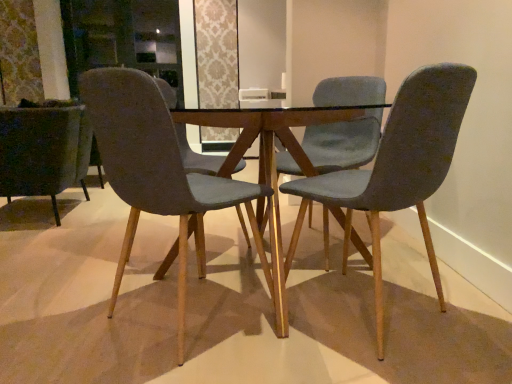
The image size is (512, 384). Describe the element at coordinates (157, 171) in the screenshot. I see `velvet grey chair at center, the 2th chair from the left` at that location.

In order to click on velvet grey chair at center, the 2th chair from the left in this screenshot , I will do `click(157, 171)`.

Between velvet grey chair at center, the 2th chair from the left, and velvet grey chair at right, the 4th chair from the left, which one has larger width?

velvet grey chair at center, the 2th chair from the left, is wider.

Between velvet teal chair at center, acting as the 2th chair starting from the right, and velvet dark green armchair at left, which is the 4th chair in right-to-left order, which one has more height?

With more height is velvet teal chair at center, acting as the 2th chair starting from the right.

Where is `the 2nd chair counting from the right side of the velvet dark green armchair at left, which is the 4th chair in right-to-left order`? The width and height of the screenshot is (512, 384). the 2nd chair counting from the right side of the velvet dark green armchair at left, which is the 4th chair in right-to-left order is located at coordinates (343, 142).

Is velvet teal chair at center, the 3th chair when ordered from left to right, bigger than velvet dark green armchair at left, which is the 4th chair in right-to-left order?

Incorrect, velvet teal chair at center, the 3th chair when ordered from left to right, is not larger than velvet dark green armchair at left, which is the 4th chair in right-to-left order.

Considering the positions of objects velvet teal chair at center, acting as the 2th chair starting from the right, and velvet dark green armchair at left, which is the 4th chair in right-to-left order, in the image provided, who is more to the left, velvet teal chair at center, acting as the 2th chair starting from the right, or velvet dark green armchair at left, which is the 4th chair in right-to-left order,?

From the viewer's perspective, velvet dark green armchair at left, which is the 4th chair in right-to-left order, appears more on the left side.

In terms of height, does velvet grey chair at right, the 4th chair from the left, look taller or shorter compared to velvet grey chair at center, which is the third chair in right-to-left order?

velvet grey chair at right, the 4th chair from the left, is taller than velvet grey chair at center, which is the third chair in right-to-left order.

In terms of width, does velvet grey chair at right, which appears as the first chair when viewed from the right, look wider or thinner when compared to velvet grey chair at center, the 2th chair from the left?

Considering their sizes, velvet grey chair at right, which appears as the first chair when viewed from the right, looks slimmer than velvet grey chair at center, the 2th chair from the left.

Is velvet grey chair at right, the 4th chair from the left, situated inside velvet grey chair at center, which is the third chair in right-to-left order, or outside?

velvet grey chair at right, the 4th chair from the left, is not enclosed by velvet grey chair at center, which is the third chair in right-to-left order.

What's the angular difference between velvet grey chair at right, which appears as the first chair when viewed from the right, and velvet grey chair at center, which is the third chair in right-to-left order,'s facing directions?

87.8 degrees separate the facing orientations of velvet grey chair at right, which appears as the first chair when viewed from the right, and velvet grey chair at center, which is the third chair in right-to-left order.

Between velvet dark green armchair at left, marked as the first chair in a left-to-right arrangement, and velvet teal chair at center, the 3th chair when ordered from left to right, which one has larger size?

With larger size is velvet dark green armchair at left, marked as the first chair in a left-to-right arrangement.

How distant is velvet dark green armchair at left, marked as the first chair in a left-to-right arrangement, from velvet teal chair at center, acting as the 2th chair starting from the right?

velvet dark green armchair at left, marked as the first chair in a left-to-right arrangement, is 1.51 meters from velvet teal chair at center, acting as the 2th chair starting from the right.

Does point (54, 141) appear closer or farther from the camera than point (345, 128)?

Point (54, 141) is positioned farther from the camera compared to point (345, 128).

Considering the relative positions of velvet dark green armchair at left, marked as the first chair in a left-to-right arrangement, and velvet teal chair at center, the 3th chair when ordered from left to right, in the image provided, is velvet dark green armchair at left, marked as the first chair in a left-to-right arrangement, to the left of velvet teal chair at center, the 3th chair when ordered from left to right, from the viewer's perspective?

Indeed, velvet dark green armchair at left, marked as the first chair in a left-to-right arrangement, is positioned on the left side of velvet teal chair at center, the 3th chair when ordered from left to right.

Between velvet teal chair at center, acting as the 2th chair starting from the right, and velvet grey chair at right, the 4th chair from the left, which one is positioned behind?

velvet teal chair at center, acting as the 2th chair starting from the right, is behind.

This screenshot has width=512, height=384. In order to click on the 2nd chair located above the velvet grey chair at right, the 4th chair from the left (from a real-world perspective) in this screenshot , I will do `click(343, 142)`.

In the scene shown: Does velvet teal chair at center, acting as the 2th chair starting from the right, have a smaller size compared to velvet grey chair at right, the 4th chair from the left?

No, velvet teal chair at center, acting as the 2th chair starting from the right, is not smaller than velvet grey chair at right, the 4th chair from the left.

Is velvet dark green armchair at left, marked as the first chair in a left-to-right arrangement, turned away from velvet grey chair at center, which is the third chair in right-to-left order?

No, velvet grey chair at center, which is the third chair in right-to-left order, is not at the back of velvet dark green armchair at left, marked as the first chair in a left-to-right arrangement.

Is velvet dark green armchair at left, which is the 4th chair in right-to-left order, thinner than velvet grey chair at center, which is the third chair in right-to-left order?

Incorrect, the width of velvet dark green armchair at left, which is the 4th chair in right-to-left order, is not less than that of velvet grey chair at center, which is the third chair in right-to-left order.

From a real-world perspective, who is located higher, velvet dark green armchair at left, which is the 4th chair in right-to-left order, or velvet grey chair at center, the 2th chair from the left?

velvet grey chair at center, the 2th chair from the left.

In terms of height, does velvet grey chair at right, which appears as the first chair when viewed from the right, look taller or shorter compared to velvet teal chair at center, the 3th chair when ordered from left to right?

Considering their sizes, velvet grey chair at right, which appears as the first chair when viewed from the right, has less height than velvet teal chair at center, the 3th chair when ordered from left to right.

Is velvet grey chair at right, which appears as the first chair when viewed from the right, with velvet teal chair at center, the 3th chair when ordered from left to right?

velvet grey chair at right, which appears as the first chair when viewed from the right, is not next to velvet teal chair at center, the 3th chair when ordered from left to right, and they're not touching.

From the image's perspective, which one is positioned lower, velvet grey chair at right, the 4th chair from the left, or velvet teal chair at center, acting as the 2th chair starting from the right?

velvet grey chair at right, the 4th chair from the left.

Where is `chair in front of the velvet grey chair at right, the 4th chair from the left`? chair in front of the velvet grey chair at right, the 4th chair from the left is located at coordinates (157, 171).

From a real-world perspective, count 3rd chairs upward from the velvet dark green armchair at left, which is the 4th chair in right-to-left order, and point to it. Please provide its 2D coordinates.

[(343, 142)]

When comparing their distances from velvet dark green armchair at left, marked as the first chair in a left-to-right arrangement, does velvet grey chair at center, which is the third chair in right-to-left order, or velvet teal chair at center, the 3th chair when ordered from left to right, seem closer?

velvet grey chair at center, which is the third chair in right-to-left order, is positioned closer to the anchor velvet dark green armchair at left, marked as the first chair in a left-to-right arrangement.

Considering their positions, is velvet dark green armchair at left, which is the 4th chair in right-to-left order, positioned closer to velvet teal chair at center, the 3th chair when ordered from left to right, than velvet grey chair at right, the 4th chair from the left?

The object closer to velvet teal chair at center, the 3th chair when ordered from left to right, is velvet grey chair at right, the 4th chair from the left.

From the image, which object appears to be nearer to velvet grey chair at right, which appears as the first chair when viewed from the right, velvet grey chair at center, which is the third chair in right-to-left order, or velvet dark green armchair at left, which is the 4th chair in right-to-left order?

velvet grey chair at center, which is the third chair in right-to-left order, is closer to velvet grey chair at right, which appears as the first chair when viewed from the right.

Based on the photo, considering their positions, is velvet teal chair at center, the 3th chair when ordered from left to right, positioned closer to velvet grey chair at right, the 4th chair from the left, than velvet dark green armchair at left, which is the 4th chair in right-to-left order?

velvet teal chair at center, the 3th chair when ordered from left to right, lies closer to velvet grey chair at right, the 4th chair from the left, than the other object.

Looking at the image, which one is located closer to velvet dark green armchair at left, which is the 4th chair in right-to-left order, velvet grey chair at center, the 2th chair from the left, or velvet grey chair at right, which appears as the first chair when viewed from the right?

velvet grey chair at center, the 2th chair from the left, is positioned closer to the anchor velvet dark green armchair at left, which is the 4th chair in right-to-left order.

From the picture: Based on their spatial positions, is velvet grey chair at center, the 2th chair from the left, or velvet dark green armchair at left, marked as the first chair in a left-to-right arrangement, closer to velvet teal chair at center, acting as the 2th chair starting from the right?

velvet grey chair at center, the 2th chair from the left, is positioned closer to the anchor velvet teal chair at center, acting as the 2th chair starting from the right.

When comparing their distances from velvet grey chair at center, which is the third chair in right-to-left order, does velvet dark green armchair at left, which is the 4th chair in right-to-left order, or velvet teal chair at center, acting as the 2th chair starting from the right, seem closer?

velvet teal chair at center, acting as the 2th chair starting from the right.

Based on their spatial positions, is velvet teal chair at center, the 3th chair when ordered from left to right, or velvet grey chair at right, which appears as the first chair when viewed from the right, further from velvet grey chair at center, which is the third chair in right-to-left order?

velvet teal chair at center, the 3th chair when ordered from left to right, lies further to velvet grey chair at center, which is the third chair in right-to-left order, than the other object.

Image resolution: width=512 pixels, height=384 pixels. I want to click on chair located between velvet grey chair at center, which is the third chair in right-to-left order, and velvet teal chair at center, acting as the 2th chair starting from the right, in the depth direction, so click(x=398, y=167).

Where is `chair between velvet dark green armchair at left, which is the 4th chair in right-to-left order, and velvet teal chair at center, the 3th chair when ordered from left to right`? The height and width of the screenshot is (384, 512). chair between velvet dark green armchair at left, which is the 4th chair in right-to-left order, and velvet teal chair at center, the 3th chair when ordered from left to right is located at coordinates (157, 171).